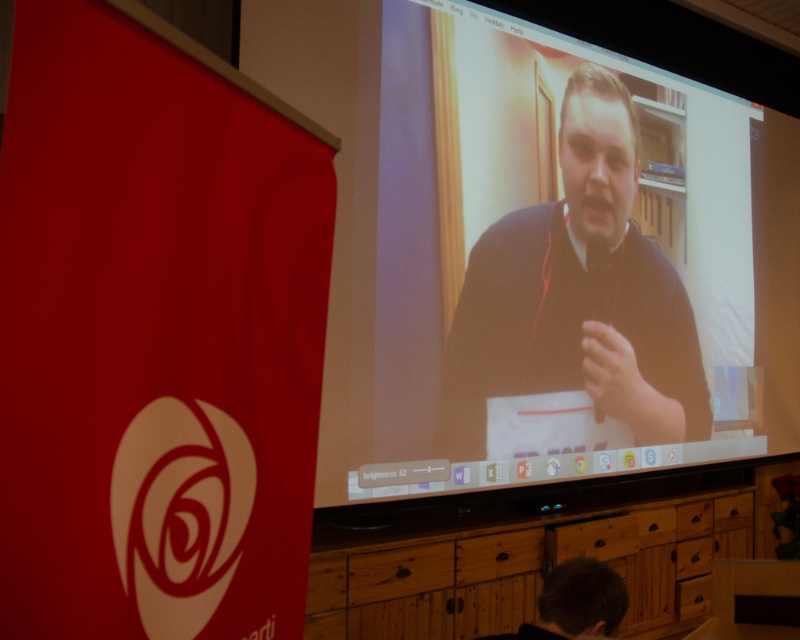
Question: Is dark brown sweater at center thinner than wooden at center?

Choices:
 (A) no
 (B) yes

Answer: (B)

Question: Estimate the real-world distances between objects in this image. Which object is closer to the dark brown hair at lower center?

Choices:
 (A) matte black laptop at upper center
 (B) dark brown sweater at center
 (C) wooden at center

Answer: (C)

Question: Which point is closer to the camera taking this photo?

Choices:
 (A) (570, 573)
 (B) (502, 602)
 (C) (504, 276)
 (D) (732, 298)

Answer: (A)

Question: Is wooden at center positioned in front of dark brown hair at lower center?

Choices:
 (A) yes
 (B) no

Answer: (B)

Question: Which of the following is the closest to the observer?

Choices:
 (A) [x=641, y=353]
 (B) [x=480, y=586]

Answer: (B)

Question: Considering the relative positions of dark brown sweater at center and dark brown hair at lower center in the image provided, where is dark brown sweater at center located with respect to dark brown hair at lower center?

Choices:
 (A) above
 (B) below

Answer: (A)